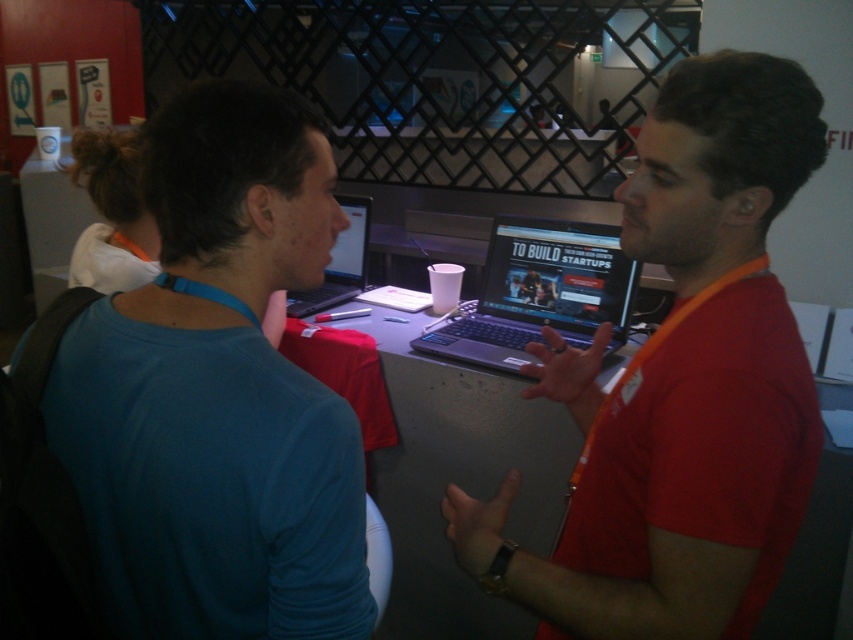
You are a GUI agent. You are given a task and a screenshot of the screen. Output one action in this format:
    pyautogui.click(x=<x>, y=<y>)
    Task: Click on the orange fabric shirt at center
    The image size is (853, 640).
    Given the screenshot: What is the action you would take?
    pyautogui.click(x=682, y=385)

Consider the image. Between orange fabric shirt at center and matte black laptop at center, which one has more height?

With more height is orange fabric shirt at center.

Between point (527, 396) and point (352, 220), which one is positioned in front?

Positioned in front is point (527, 396).

Where is `orange fabric shirt at center`? orange fabric shirt at center is located at coordinates (682, 385).

Does orange fabric shirt at center have a lesser height compared to silver metallic laptop at center?

No, orange fabric shirt at center is not shorter than silver metallic laptop at center.

Looking at this image, who is shorter, orange fabric shirt at center or silver metallic laptop at center?

Standing shorter between the two is silver metallic laptop at center.

This screenshot has width=853, height=640. What do you see at coordinates (682, 385) in the screenshot? I see `orange fabric shirt at center` at bounding box center [682, 385].

This screenshot has height=640, width=853. Identify the location of orange fabric shirt at center. (682, 385).

From the picture: Who is more distant from viewer, (257,625) or (355,275)?

The point (355,275) is more distant.

Does blue fabric shirt at upper left have a lesser width compared to matte black laptop at center?

In fact, blue fabric shirt at upper left might be wider than matte black laptop at center.

Describe the element at coordinates (218, 392) in the screenshot. The height and width of the screenshot is (640, 853). I see `blue fabric shirt at upper left` at that location.

At what (x,y) coordinates should I click in order to perform the action: click on blue fabric shirt at upper left. Please return your answer as a coordinate pair (x, y). The height and width of the screenshot is (640, 853). Looking at the image, I should click on (218, 392).